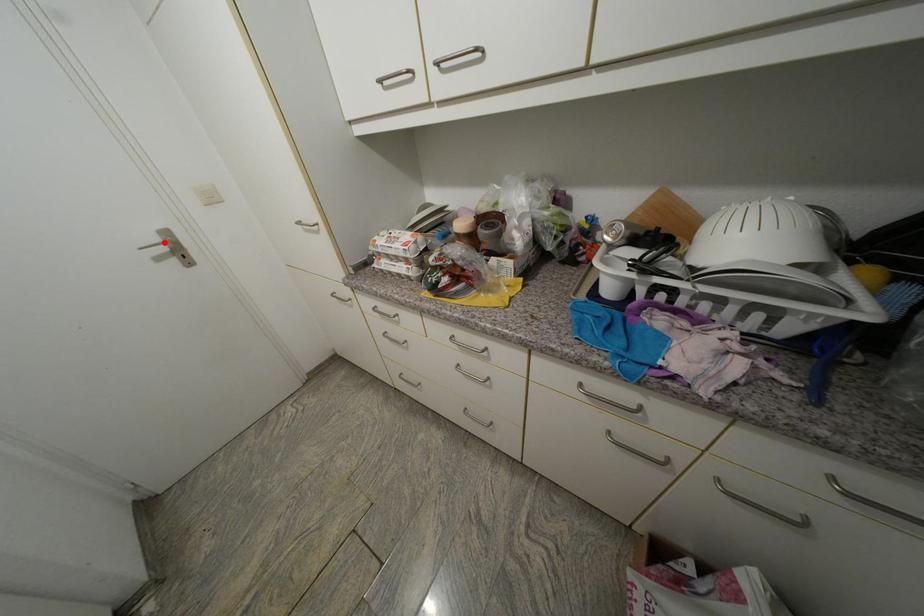
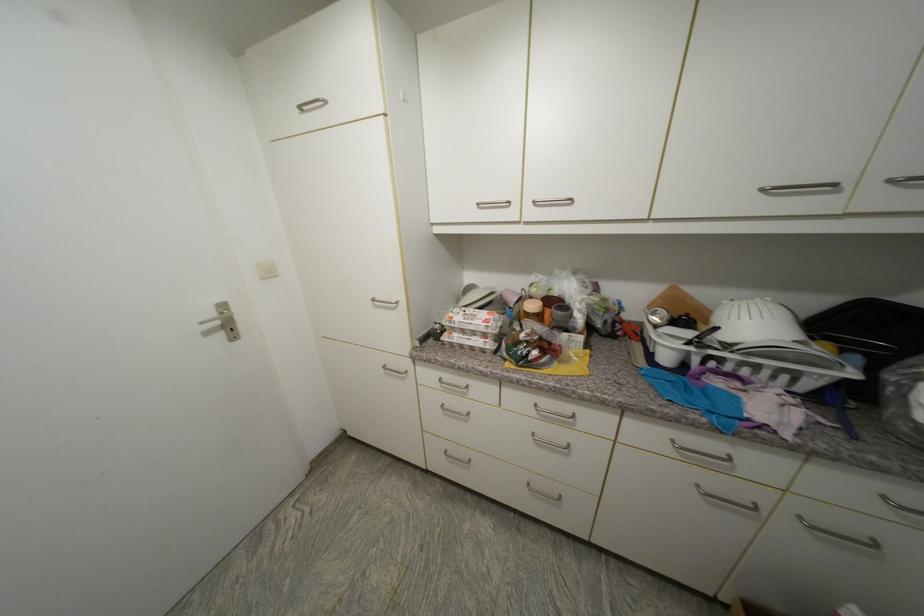
Locate, in the second image, the point that corresponds to the highlighted location in the first image.

(220, 315)